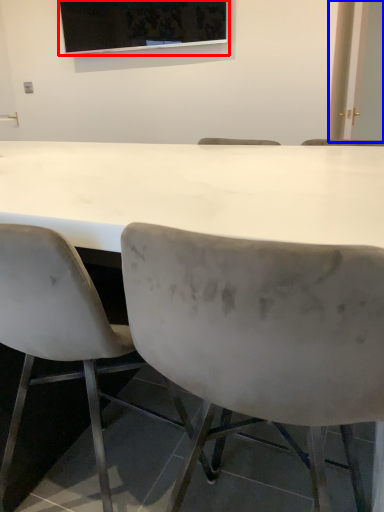
Question: Which point is closer to the camera, projection screen (highlighted by a red box) or glass door (highlighted by a blue box)?

Choices:
 (A) projection screen
 (B) glass door

Answer: (A)